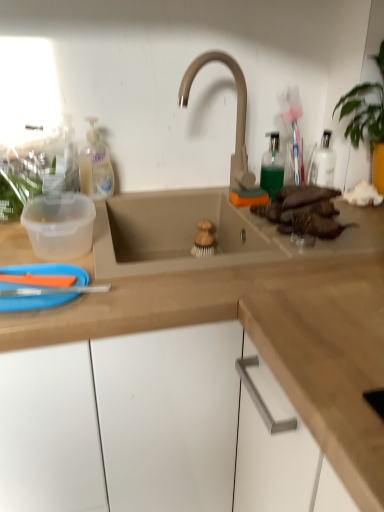
This screenshot has width=384, height=512. I want to click on free location to the right of translucent plastic bottle at upper left, so click(158, 193).